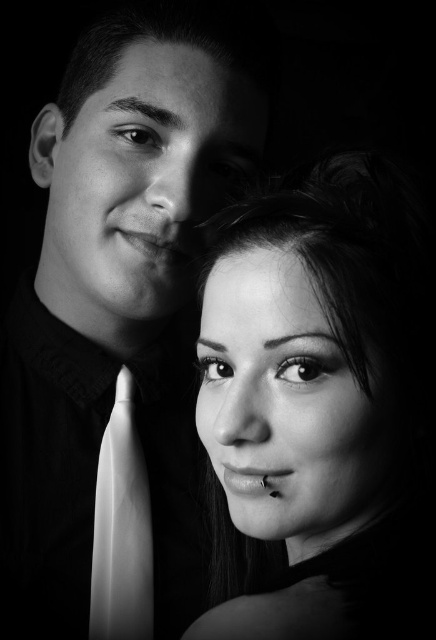
Question: Which point is closer to the camera taking this photo?

Choices:
 (A) (371, 202)
 (B) (143, 563)

Answer: (A)

Question: Considering the relative positions of smooth skin face at center and white silk tie at left in the image provided, where is smooth skin face at center located with respect to white silk tie at left?

Choices:
 (A) above
 (B) below

Answer: (A)

Question: Which of the following is the farthest from the observer?

Choices:
 (A) white silk tie at left
 (B) smooth skin face at center

Answer: (A)

Question: Can you confirm if smooth skin face at center is positioned above white silk tie at left?

Choices:
 (A) no
 (B) yes

Answer: (B)

Question: Is smooth skin face at center smaller than white silk tie at left?

Choices:
 (A) yes
 (B) no

Answer: (B)